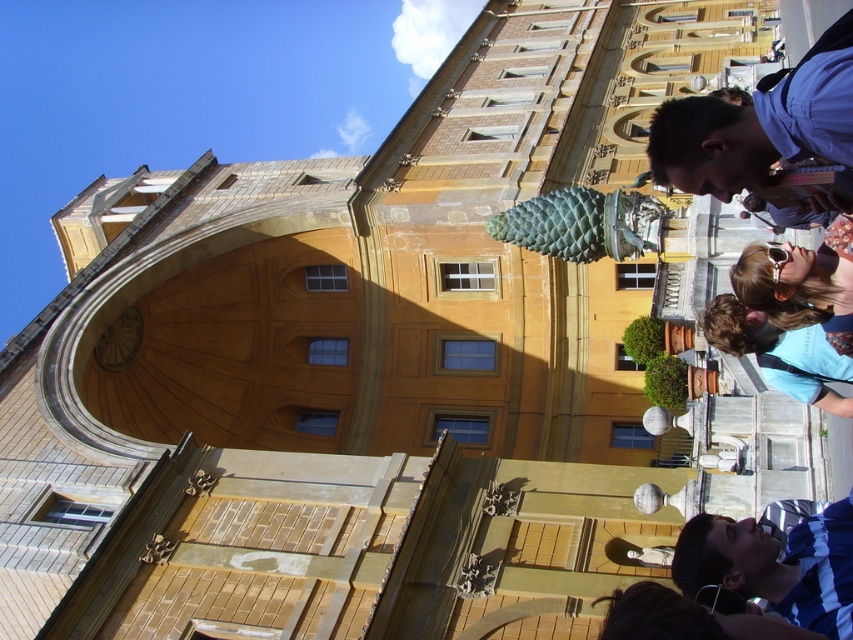
Is blue shirt at upper right to the right of matte gold sunglasses at upper right from the viewer's perspective?

Indeed, blue shirt at upper right is positioned on the right side of matte gold sunglasses at upper right.

Which is below, blue shirt at upper right or matte gold sunglasses at upper right?

Positioned lower is matte gold sunglasses at upper right.

Which is in front, point (666, 157) or point (796, 317)?

Positioned in front is point (666, 157).

This screenshot has width=853, height=640. What are the coordinates of `blue shirt at upper right` in the screenshot? It's located at (759, 124).

Is point (758, 292) positioned behind point (788, 387)?

No, it is in front of (788, 387).

Between matte gold sunglasses at upper right and brown hair at lower right, which one appears on the right side from the viewer's perspective?

matte gold sunglasses at upper right

Which is in front, point (836, 252) or point (747, 339)?

Positioned in front is point (836, 252).

Identify the location of matte gold sunglasses at upper right. Image resolution: width=853 pixels, height=640 pixels. [x=798, y=280].

Between blue shirt at upper right and blue striped shirt at lower right, which one has more height?

blue shirt at upper right

Does point (778, 108) come closer to viewer compared to point (761, 531)?

That is True.

Identify the location of blue shirt at upper right. Image resolution: width=853 pixels, height=640 pixels. (759, 124).

This screenshot has height=640, width=853. In order to click on blue shirt at upper right in this screenshot , I will do `click(759, 124)`.